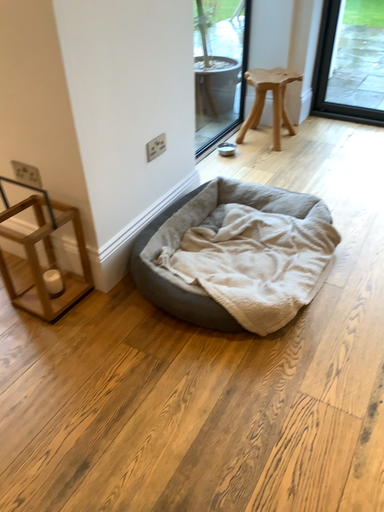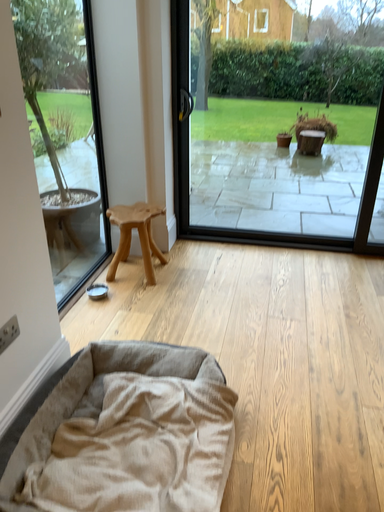
Question: Which way did the camera rotate in the video?

Choices:
 (A) rotated left
 (B) rotated right

Answer: (B)